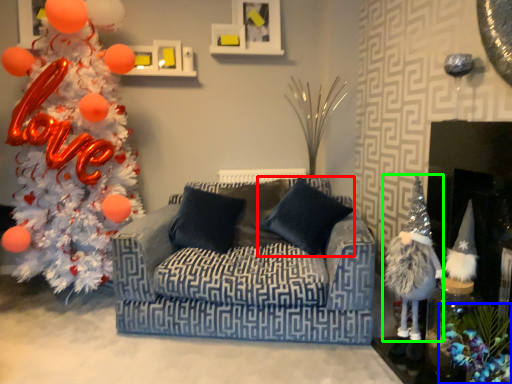
Question: Which object is positioned closest to pillow (highlighted by a red box)? Select from christmas decoration (highlighted by a blue box) and toy (highlighted by a green box).

Choices:
 (A) christmas decoration
 (B) toy

Answer: (B)